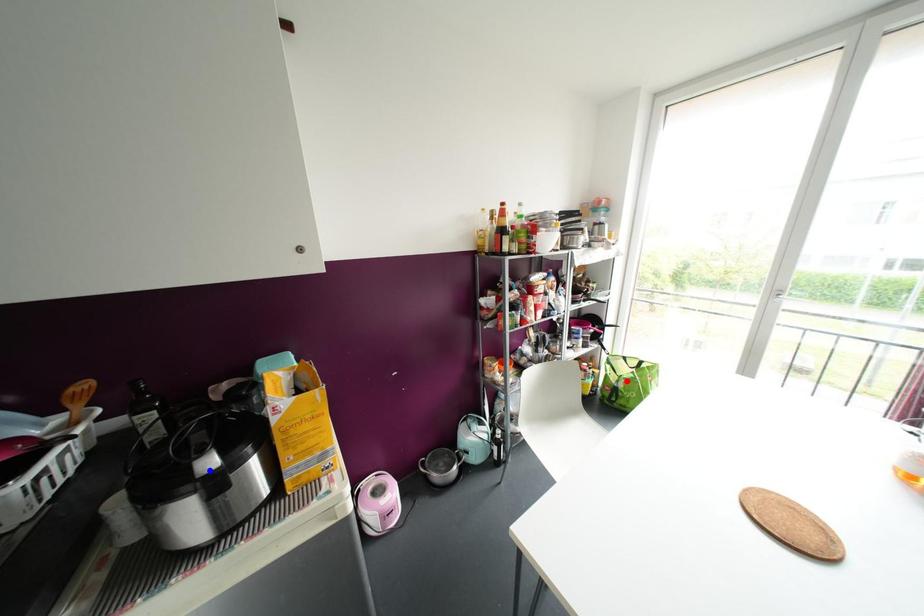
Question: Two points are marked on the image. Which point is closer to the camera?

Choices:
 (A) Blue point is closer.
 (B) Red point is closer.

Answer: (A)